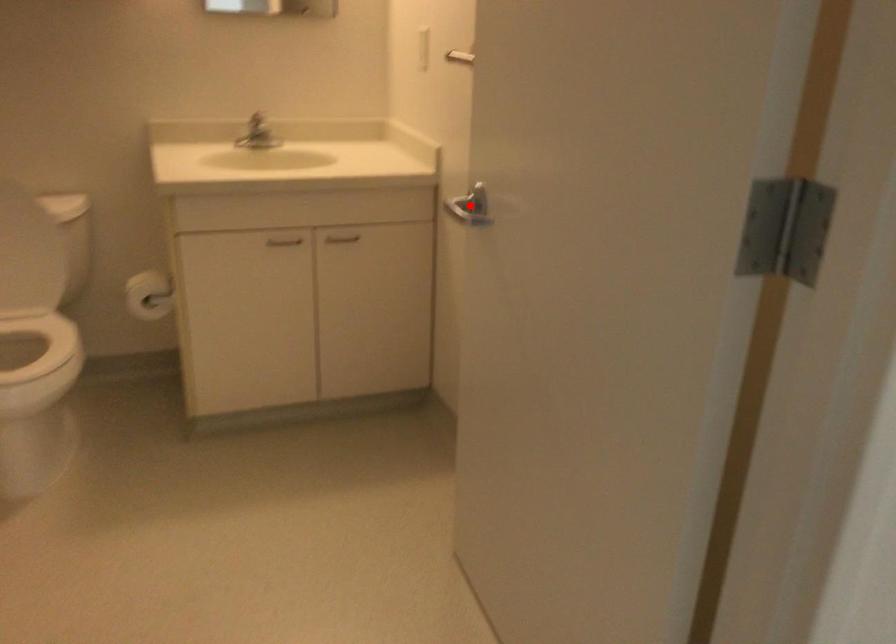
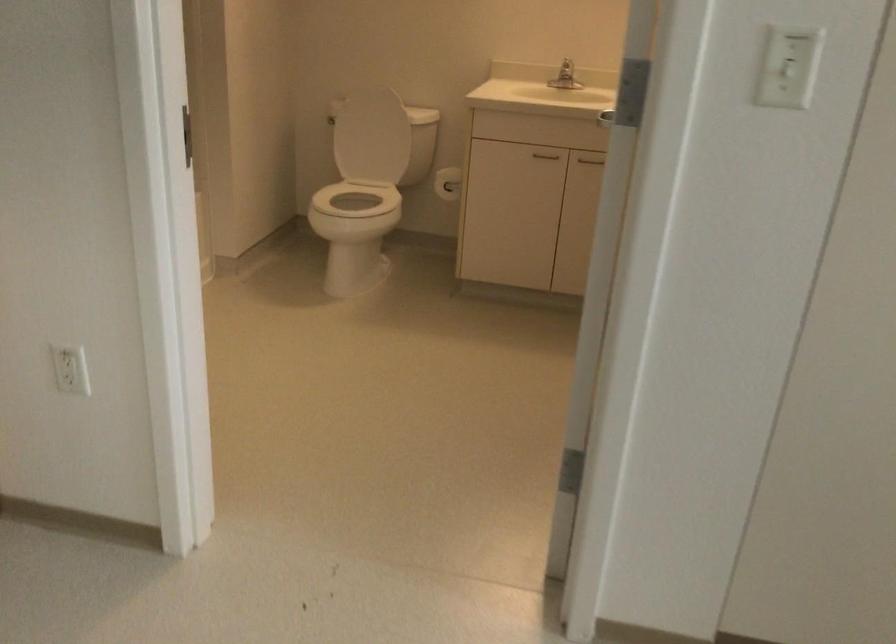
Question: I am providing you with two images of the same scene from different viewpoints. A red point is marked on the first image. At the location where the point appears in image 1, is it still visible in image 2?

Choices:
 (A) Yes
 (B) No

Answer: (B)